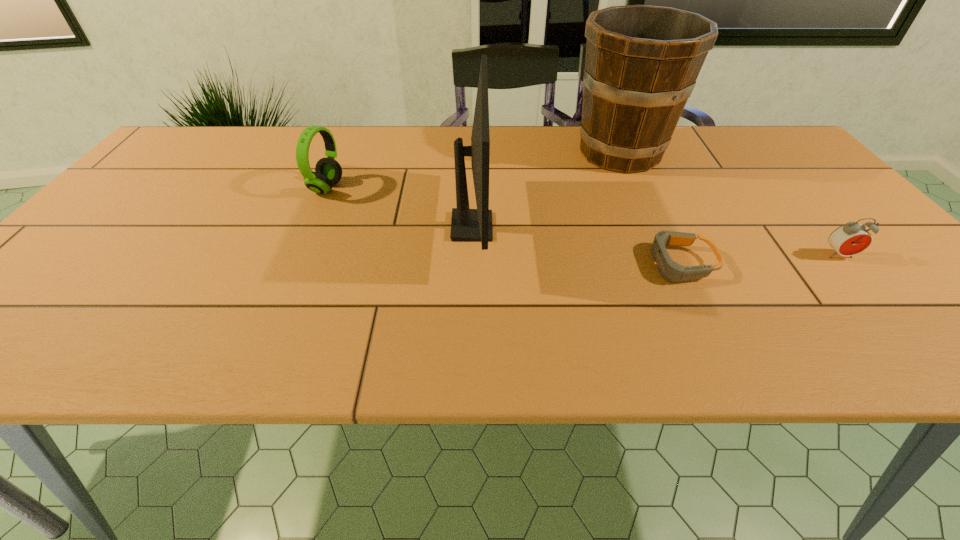
Where is `bucket`? This screenshot has width=960, height=540. bucket is located at coordinates (642, 62).

This screenshot has width=960, height=540. What are the coordinates of `the fourth object from right to left` in the screenshot? It's located at (467, 225).

The width and height of the screenshot is (960, 540). What are the coordinates of `headset` in the screenshot? It's located at (328, 171).

You are a GUI agent. You are given a task and a screenshot of the screen. Output one action in this format:
    pyautogui.click(x=<x>, y=<y>)
    Task: Click on the leftmost object
    The height and width of the screenshot is (540, 960).
    Given the screenshot: What is the action you would take?
    pyautogui.click(x=328, y=171)

The height and width of the screenshot is (540, 960). Identify the location of the fourth tallest object. (850, 239).

Where is `alarm clock`? This screenshot has height=540, width=960. alarm clock is located at coordinates [850, 239].

Locate an element on the screen. goggles is located at coordinates (670, 270).

Find the location of a particular element. The image size is (960, 540). vacant space situated 0.290m on the right of the bucket is located at coordinates (774, 153).

This screenshot has height=540, width=960. In order to click on free location located on the front-facing side of the computer monitor in this screenshot , I will do `click(536, 226)`.

Where is `blank area located on the back of the headset`? blank area located on the back of the headset is located at coordinates (343, 152).